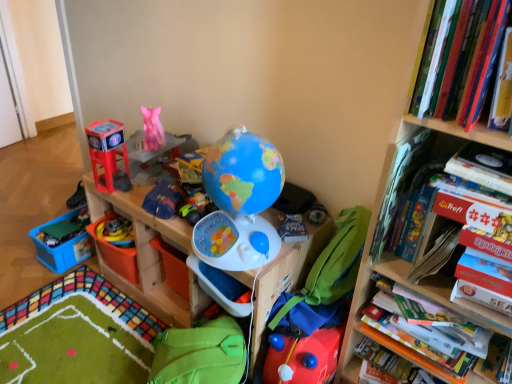
I want to click on vacant point above rubberized red toy at lower center, the sixth toy from the left (from a real-world perspective), so click(x=312, y=332).